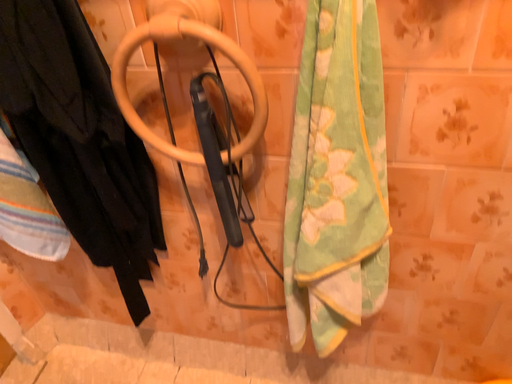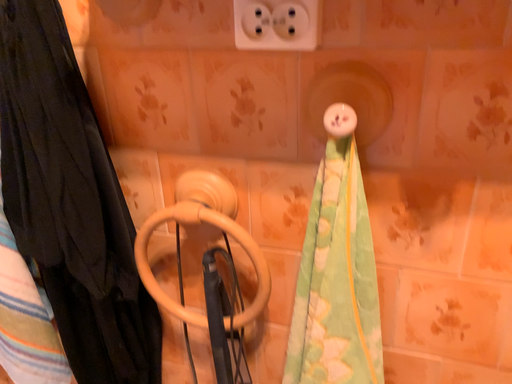
Question: How did the camera likely rotate when shooting the video?

Choices:
 (A) rotated downward
 (B) rotated upward

Answer: (B)